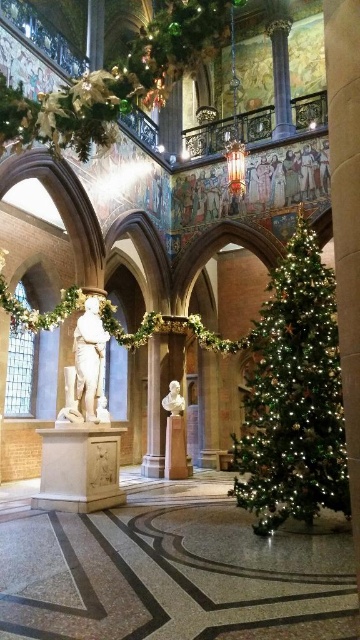
Question: Is green leafy garland at upper center bigger than white marble statue at center?

Choices:
 (A) yes
 (B) no

Answer: (A)

Question: Which point is closer to the camera taking this photo?

Choices:
 (A) (84, 340)
 (B) (155, 54)
 (C) (177, 390)
 (D) (263, 435)

Answer: (B)

Question: Is green leafy garland at upper center to the right of white marble bust at center from the viewer's perspective?

Choices:
 (A) no
 (B) yes

Answer: (A)

Question: Does green leafy garland at upper center have a smaller size compared to white marble statue at center?

Choices:
 (A) no
 (B) yes

Answer: (A)

Question: Which point is closer to the camera?

Choices:
 (A) (281, 436)
 (B) (69, 381)
 (C) (78, 145)

Answer: (C)

Question: Which object is the closest to the white marble statue at center?

Choices:
 (A) green matte christmas tree at right
 (B) green leafy garland at upper center
 (C) white marble bust at center

Answer: (C)